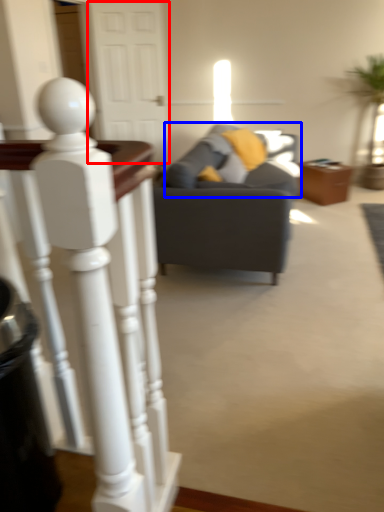
Question: Among these objects, which one is farthest to the camera, glass door (highlighted by a red box) or swivel chair (highlighted by a blue box)?

Choices:
 (A) glass door
 (B) swivel chair

Answer: (A)